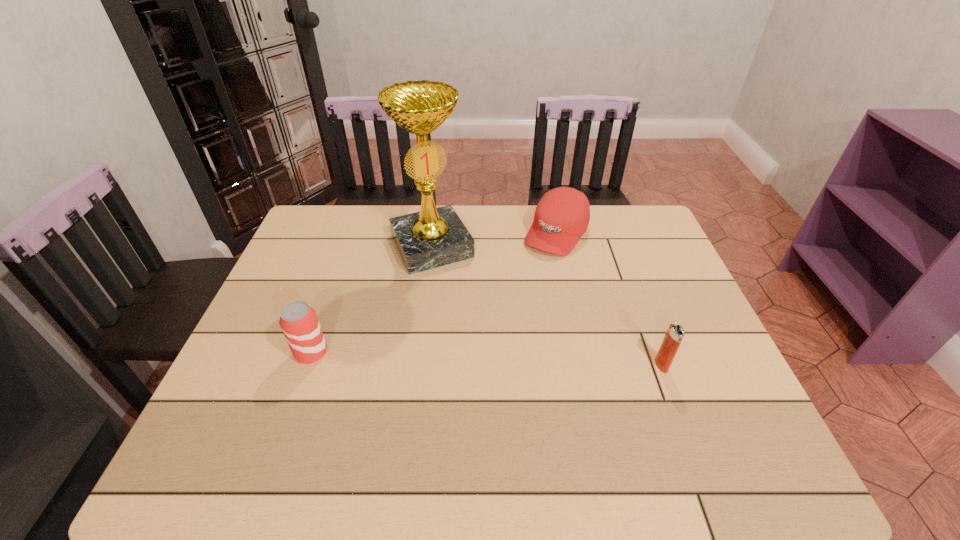
Image resolution: width=960 pixels, height=540 pixels. I want to click on the leftmost object, so click(298, 320).

Where is `igniter`? The width and height of the screenshot is (960, 540). igniter is located at coordinates (674, 335).

I want to click on the tallest object, so click(434, 237).

Locate an element on the screen. Image resolution: width=960 pixels, height=540 pixels. the third object from right to left is located at coordinates (434, 237).

The width and height of the screenshot is (960, 540). I want to click on cap, so click(x=562, y=215).

Image resolution: width=960 pixels, height=540 pixels. I want to click on free spot located 0.070m on the right of the beer can, so [357, 353].

At what (x,y) coordinates should I click in order to perform the action: click on vacant region located 0.330m on the left of the igniter. Please return your answer as a coordinate pair (x, y). Looking at the image, I should click on (514, 365).

At what (x,y) coordinates should I click in order to perform the action: click on vacant area situated 0.340m on the front-facing side of the second object from left to right. Please return your answer as a coordinate pair (x, y). Looking at the image, I should click on (494, 361).

Identify the location of blank space located 0.140m on the front-facing side of the second object from left to right. (464, 305).

This screenshot has width=960, height=540. I want to click on vacant area situated on the front-facing side of the second object from left to right, so click(x=490, y=352).